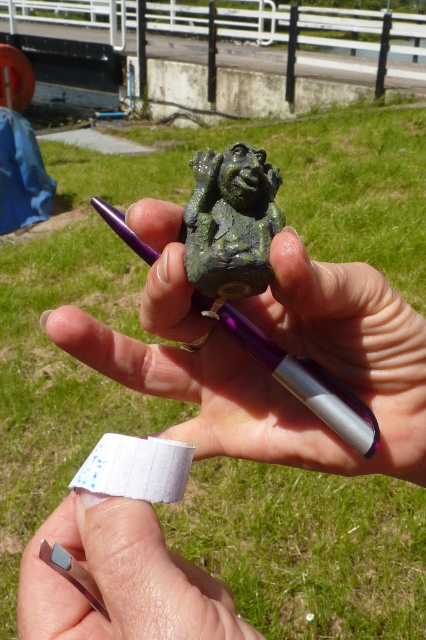
Is point (253, 237) farther from camera compared to point (94, 461)?

Yes, point (253, 237) is farther from viewer.

Between green patina stone statue at center and white adhesive tape at center, which one has less height?

With less height is white adhesive tape at center.

Does point (222, 156) come closer to viewer compared to point (146, 486)?

No, (222, 156) is behind (146, 486).

At what (x,y) coordinates should I click in order to perform the action: click on green patina stone statue at center. Please return your answer as a coordinate pair (x, y). This screenshot has width=426, height=640. Looking at the image, I should click on (230, 221).

Between point (244, 276) and point (334, 428), which one is positioned in front?

Positioned in front is point (244, 276).

Does green patina stone statue at center have a smaller size compared to purple metallic pen at center?

Actually, green patina stone statue at center might be larger than purple metallic pen at center.

Find the location of a particular element. green patina stone statue at center is located at coordinates (230, 221).

I want to click on green patina stone statue at center, so click(230, 221).

Measure the distance between nail polish at center and purple metallic pen at center.

5.05 inches

Is point (69, 600) behind point (226, 324)?

No, it is in front of (226, 324).

The height and width of the screenshot is (640, 426). Identify the location of nail polish at center. (120, 579).